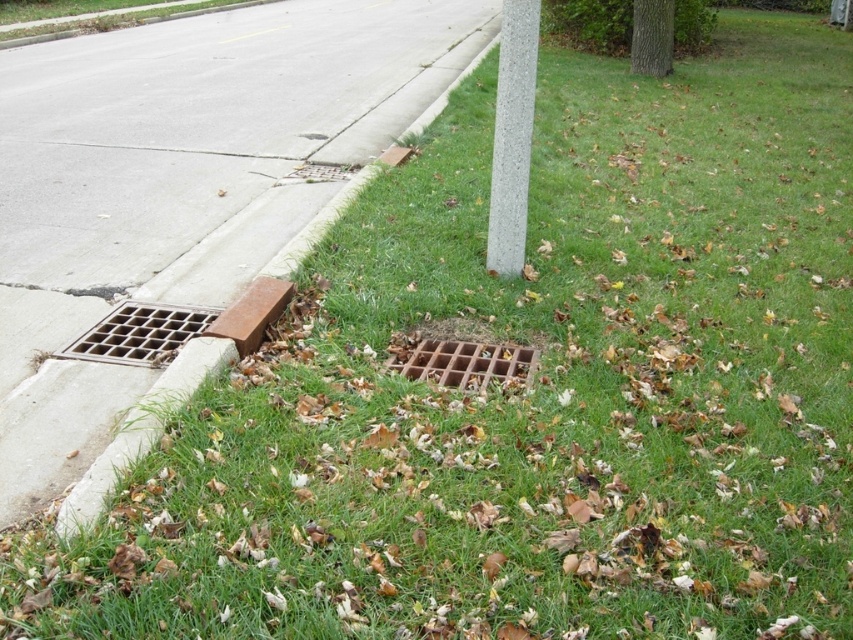
Can you confirm if brown metal grate at lower center is positioned to the left of gray concrete pole at upper center?

Indeed, brown metal grate at lower center is positioned on the left side of gray concrete pole at upper center.

Between brown metal grate at lower center and gray concrete pole at upper center, which one has more height?

With more height is brown metal grate at lower center.

Who is more distant from viewer, (276, 186) or (520, 173)?

Point (276, 186)

Where is `brown metal grate at lower center`? This screenshot has height=640, width=853. brown metal grate at lower center is located at coordinates (181, 182).

Does gray concrete pole at upper center have a greater height compared to brown metal grate at center?

Yes.

Does point (514, 168) lie behind point (511, 349)?

Yes, point (514, 168) is behind point (511, 349).

This screenshot has width=853, height=640. I want to click on gray concrete pole at upper center, so coord(512,136).

Can you confirm if brown metal grate at lower center is positioned above brown metal grate at center?

Indeed, brown metal grate at lower center is positioned over brown metal grate at center.

Find the location of a particular element. brown metal grate at lower center is located at coordinates (181, 182).

Image resolution: width=853 pixels, height=640 pixels. What do you see at coordinates (181, 182) in the screenshot?
I see `brown metal grate at lower center` at bounding box center [181, 182].

Where is `brown metal grate at lower center`? Image resolution: width=853 pixels, height=640 pixels. brown metal grate at lower center is located at coordinates (181, 182).